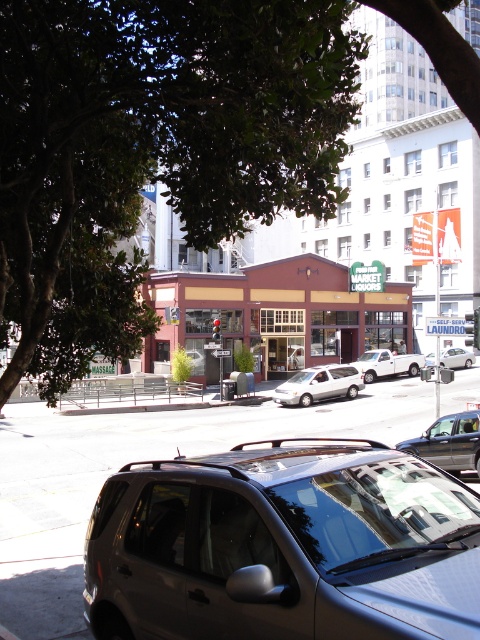
You are driving a delivery truck and need to park in the parking spot behind the white matte van at center. Is there enough space between the green leafy tree at upper left and the van to park your truck?

The green leafy tree at upper left is in front of the white matte van at center, so there is no space between them for your truck to park.

You are a delivery person needing to park your 2.5 meters tall truck. You see the green leafy tree at upper left and the white matte van at center in the image. Can your truck pass under the tree without hitting it?

The green leafy tree at upper left is shorter than the white matte van at center. Since the van is taller than the tree, and your truck is 2.5 meters tall, it depends on the van height. If the van is taller than 2.5 meters, then the tree is shorter so the truck can pass. But if the van is shorter than 2.5 meters, the tree might be too low. However, without exact heights, we can only say the tree is shorter than the van. If the van is at least 2.5m tall, then yes.